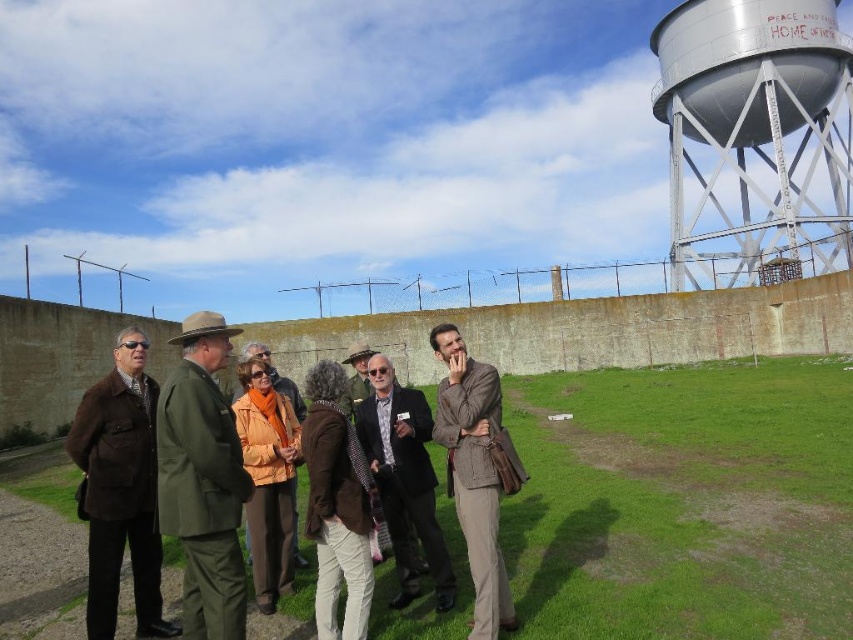
Question: Can you confirm if brushed metal water tower at upper right is positioned to the left of brown fur coat at center?

Choices:
 (A) no
 (B) yes

Answer: (A)

Question: Which point is closer to the camera?

Choices:
 (A) (729, 276)
 (B) (247, 353)

Answer: (B)

Question: From the image, what is the correct spatial relationship of brushed metal water tower at upper right in relation to green uniform at center?

Choices:
 (A) right
 (B) left

Answer: (A)

Question: Which point is closer to the camera?

Choices:
 (A) orange fabric jacket at center
 (B) green uniform at center

Answer: (B)

Question: Which object appears closest to the camera in this image?

Choices:
 (A) green uniform at center
 (B) orange fabric jacket at center
 (C) brown fur coat at center

Answer: (A)

Question: Does dark brown leather jacket at center have a lesser width compared to orange fabric jacket at center?

Choices:
 (A) no
 (B) yes

Answer: (B)